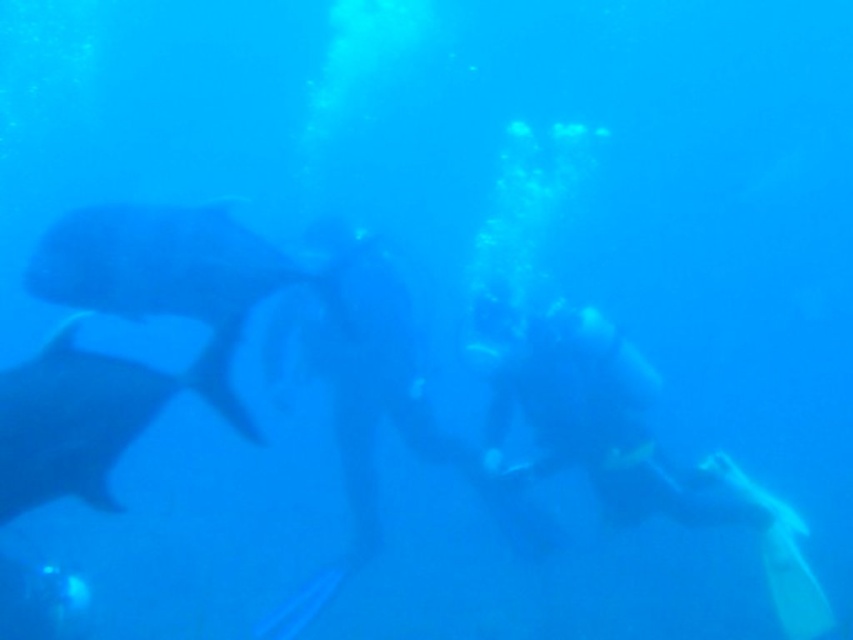
Which is behind, point (523, 381) or point (247, 276)?

Point (523, 381)

At what (x,y) coordinates should I click in order to perform the action: click on yellow rubber fins at right. Please return your answer as a coordinate pair (x, y). Looking at the image, I should click on (625, 438).

You are a GUI agent. You are given a task and a screenshot of the screen. Output one action in this format:
    pyautogui.click(x=<x>, y=<y>)
    Task: Click on the yellow rubber fins at right
    
    Given the screenshot: What is the action you would take?
    pyautogui.click(x=625, y=438)

Between smooth gray fish at left and gray matte whale at left, which one has more height?

gray matte whale at left

Between smooth gray fish at left and gray matte whale at left, which one has less height?

Standing shorter between the two is smooth gray fish at left.

Identify the location of smooth gray fish at left. The width and height of the screenshot is (853, 640). (167, 262).

Does yellow rubber fins at right have a lesser width compared to gray matte whale at left?

No.

Which is behind, point (631, 493) or point (67, 364)?

The point (631, 493) is behind.

This screenshot has height=640, width=853. I want to click on yellow rubber fins at right, so click(625, 438).